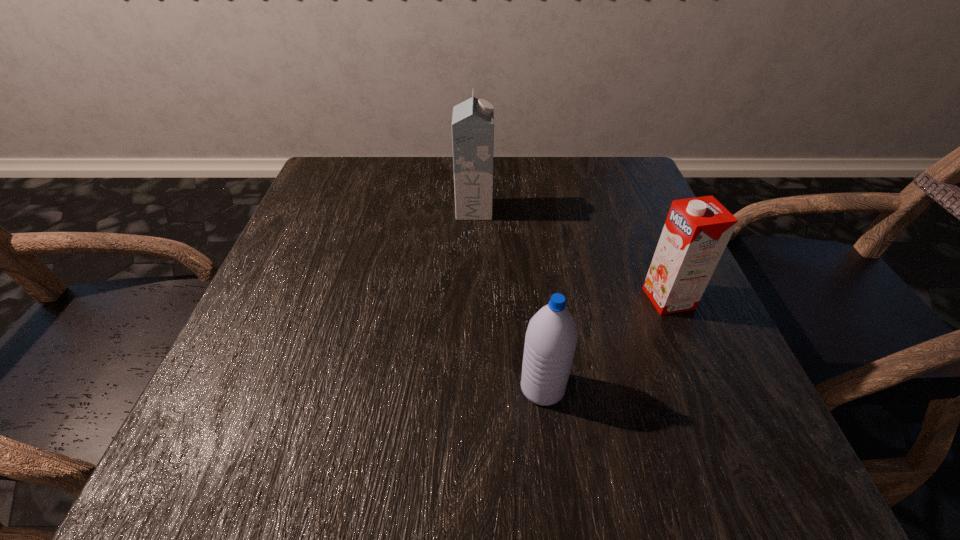
Locate an element on the screen. object that is at the right edge is located at coordinates (697, 230).

This screenshot has height=540, width=960. I want to click on vacant space at the far edge, so click(x=525, y=180).

Locate an element on the screen. Image resolution: width=960 pixels, height=540 pixels. vacant space at the near edge of the desktop is located at coordinates (420, 426).

Find the location of `vacant space at the left edge of the desktop`. vacant space at the left edge of the desktop is located at coordinates (337, 253).

Locate an element on the screen. The width and height of the screenshot is (960, 540). vacant space at the right edge is located at coordinates (696, 420).

You are a GUI agent. You are given a task and a screenshot of the screen. Output one action in this format:
    pyautogui.click(x=<x>, y=<y>)
    Task: Click on the vacant space at the far left corner
    The width and height of the screenshot is (960, 540).
    Given the screenshot: What is the action you would take?
    pyautogui.click(x=376, y=163)

You are a GUI agent. You are given a task and a screenshot of the screen. Output one action in this format:
    pyautogui.click(x=<x>, y=<y>)
    Task: Click on the vacant space at the far right corner of the desktop
    The image size is (960, 540).
    Given the screenshot: What is the action you would take?
    pyautogui.click(x=582, y=168)

The width and height of the screenshot is (960, 540). I want to click on vacant area at the near right corner, so click(x=678, y=488).

Locate an element on the screen. vacant area between the water bottle and the taller carton is located at coordinates (509, 299).

Locate an element on the screen. vacant area that lies between the nearest object and the taller carton is located at coordinates (509, 299).